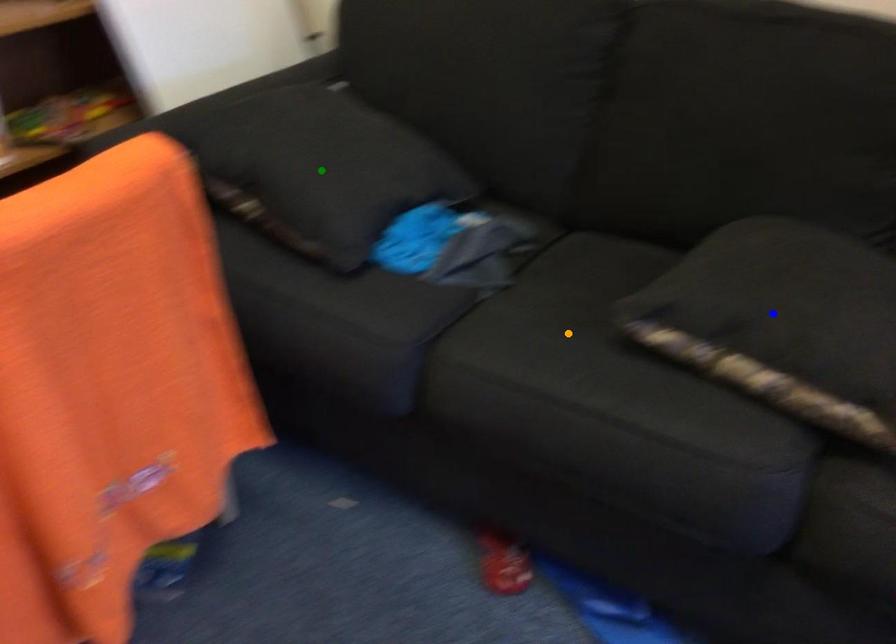
Order these from nearest to farthest:
1. blue point
2. green point
3. orange point

1. blue point
2. orange point
3. green point